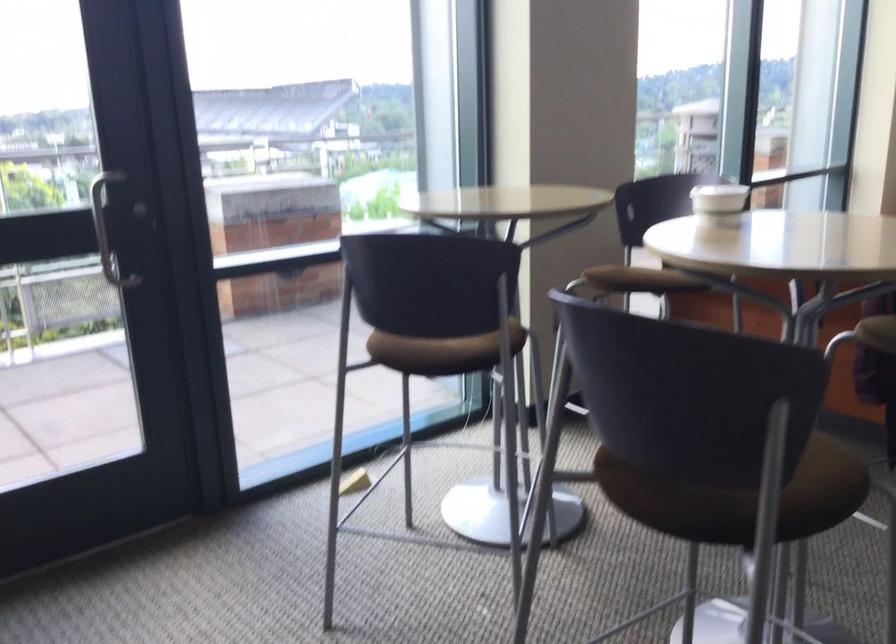
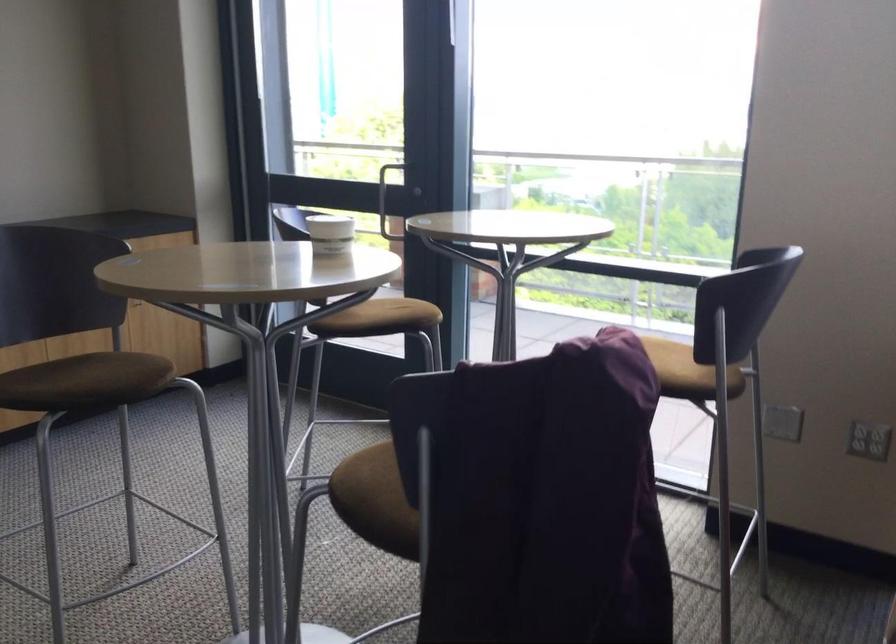
Find the pixel in the second image that matches the point at 458,337 in the first image.

(401, 314)